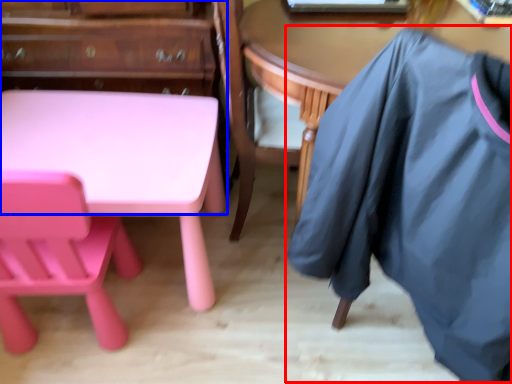
Question: Which point is further to the camera, clothing (highlighted by a red box) or dresser (highlighted by a blue box)?

Choices:
 (A) clothing
 (B) dresser

Answer: (B)